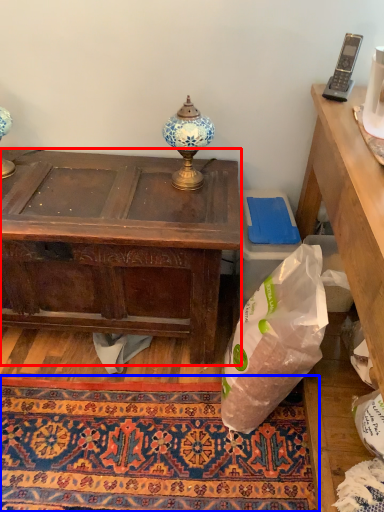
Question: Which of the following is the farthest to the observer, desk (highlighted by a red box) or mat (highlighted by a blue box)?

Choices:
 (A) desk
 (B) mat

Answer: (A)